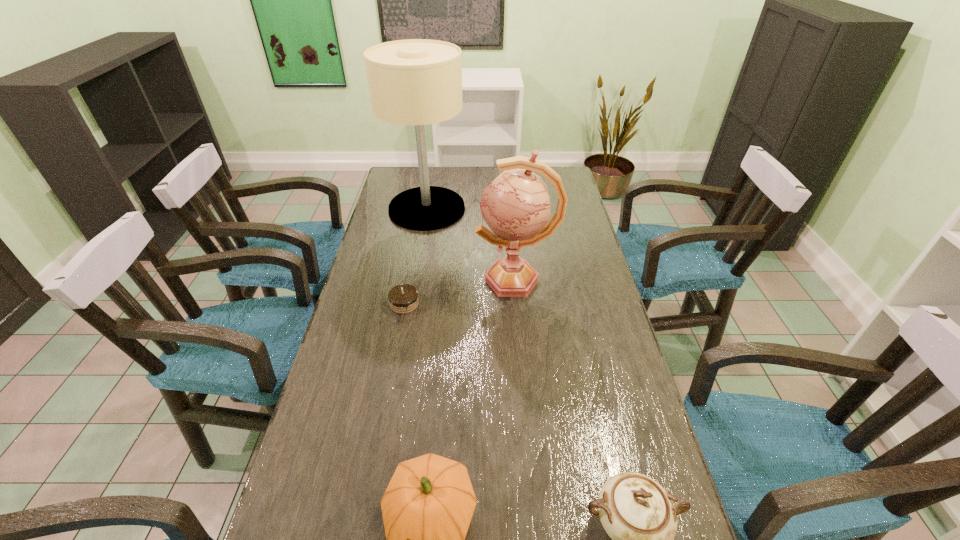
Locate an element on the screen. This screenshot has width=960, height=540. vacant region between the second tallest object and the farthest object is located at coordinates (471, 244).

At what (x,y) coordinates should I click in order to perform the action: click on unoccupied area between the tallest object and the chocolate cake. Please return your answer as a coordinate pair (x, y). This screenshot has width=960, height=540. Looking at the image, I should click on (416, 256).

Where is `vacant space that is in between the globe and the chocolate cake`? vacant space that is in between the globe and the chocolate cake is located at coordinates (460, 292).

Locate an element on the screen. The width and height of the screenshot is (960, 540). object that stands as the second closest to the globe is located at coordinates (417, 82).

The width and height of the screenshot is (960, 540). What are the coordinates of `object identified as the fourth closest to the gourd` in the screenshot? It's located at (417, 82).